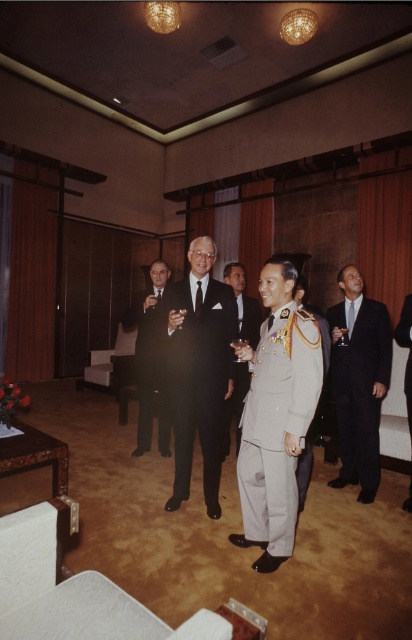
Question: Can you confirm if light beige uniform at center is bigger than black leather shoes at center?

Choices:
 (A) no
 (B) yes

Answer: (B)

Question: Which object appears farthest from the camera in this image?

Choices:
 (A) light beige uniform at center
 (B) light beige suit at center

Answer: (B)

Question: Considering the real-world distances, which object is farthest from the black satin suit at center?

Choices:
 (A) shiny black suit at center
 (B) black leather shoes at center

Answer: (A)

Question: Is light beige uniform at center in front of black leather shoes at center?

Choices:
 (A) no
 (B) yes

Answer: (B)

Question: Which of the following is the closest to the observer?

Choices:
 (A) (400, 342)
 (B) (184, 310)

Answer: (B)

Question: In this image, where is black satin suit at center located relative to shiny black suit at center?

Choices:
 (A) below
 (B) above

Answer: (A)